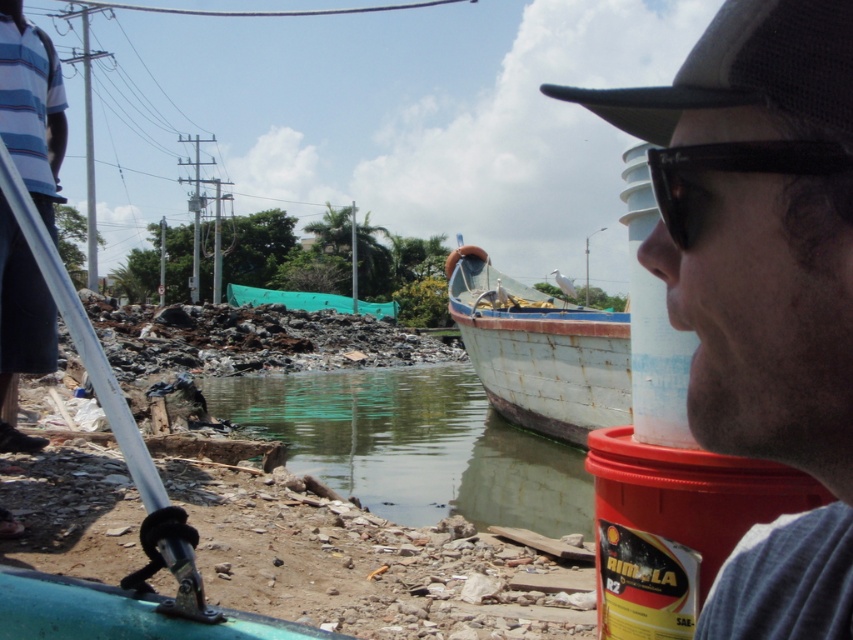
You are standing at the edge of the waterway and want to place a 2 meter long wooden board to reach the small boat with a blue hull and white trim. The board needs to be placed from the shoreline to the boat. Given that the green murky water at lower center is 6.79 meters away from camera, can the board reach the boat?

The green murky water at lower center is 6.79 meters away from camera. The board is 2 meters long, so it cannot reach the boat which is further away than the board length.

You are a photographer taking a picture of the scene. You notice the matte black cap at upper right and the green murky water at lower center. Which object is positioned higher in the image?

The matte black cap at upper right is located above the green murky water at lower center, so it is positioned higher in the image.